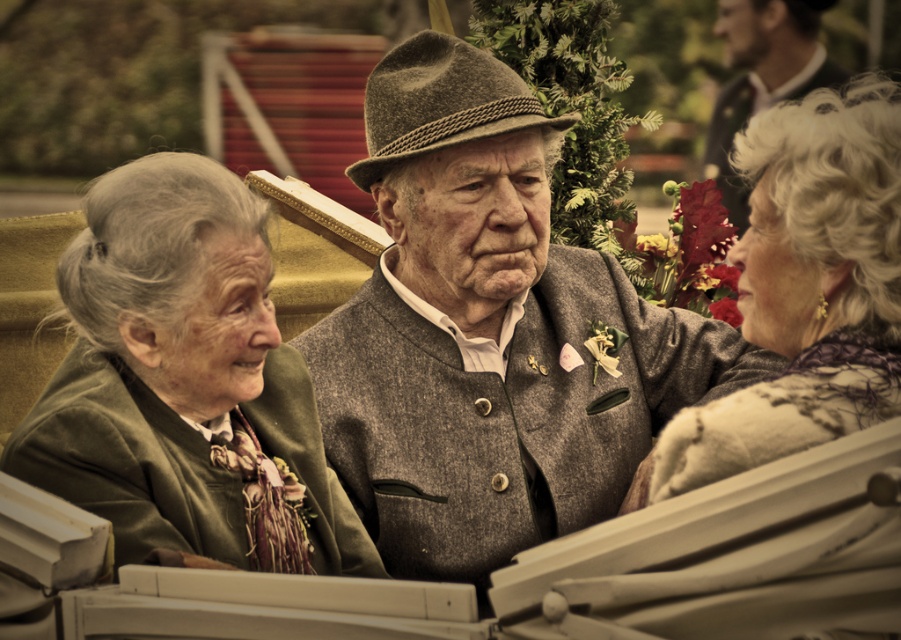
You are a photographer trying to capture a candid shot of the two subjects in the vintage carriage. You notice the green woolen coat at left and the matte gray scarf at right. Which item is located closer to the bottom of the image?

The green woolen coat at left is positioned under the matte gray scarf at right, meaning it is closer to the bottom of the image.

You are standing at point (735, 436) and want to walk to point (290, 564). Is the destination in front of or behind you?

The destination point (290, 564) is behind point (735, 436), so the destination is behind you.

You are a photographer adjusting your camera settings to capture the scene of the three elderly individuals in the vintage vehicle. You need to ensure both the textured woolen jacket at center and the matte gray scarf at right are in focus. Given their height difference, which object should you adjust your focus on first to account for depth of field?

The textured woolen jacket at center is much taller than the matte gray scarf at right. To ensure both are in focus, you should first adjust your focus on the textured woolen jacket at center since it is taller and requires more depth of field coverage.